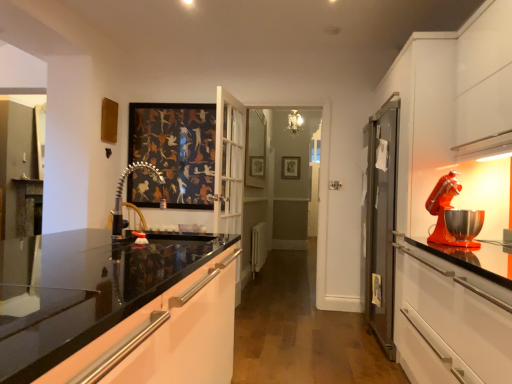
Question: From the image's perspective, would you say wooden picture frame at center is shown under polished chrome faucet at center?

Choices:
 (A) yes
 (B) no

Answer: (B)

Question: Considering the relative sizes of wooden picture frame at center and polished chrome faucet at center in the image provided, is wooden picture frame at center shorter than polished chrome faucet at center?

Choices:
 (A) yes
 (B) no

Answer: (B)

Question: Is wooden picture frame at center not inside polished chrome faucet at center?

Choices:
 (A) yes
 (B) no

Answer: (A)

Question: Is wooden picture frame at center next to polished chrome faucet at center?

Choices:
 (A) no
 (B) yes

Answer: (A)

Question: Is wooden picture frame at center turned away from polished chrome faucet at center?

Choices:
 (A) yes
 (B) no

Answer: (B)

Question: Is wooden picture frame at center further to camera compared to polished chrome faucet at center?

Choices:
 (A) no
 (B) yes

Answer: (B)

Question: Is polished chrome faucet at center oriented away from shiny orange mixer at right?

Choices:
 (A) yes
 (B) no

Answer: (B)

Question: Considering the relative sizes of polished chrome faucet at center and shiny orange mixer at right in the image provided, is polished chrome faucet at center smaller than shiny orange mixer at right?

Choices:
 (A) no
 (B) yes

Answer: (B)

Question: Is polished chrome faucet at center to the left of shiny orange mixer at right from the viewer's perspective?

Choices:
 (A) no
 (B) yes

Answer: (B)

Question: Can we say polished chrome faucet at center lies outside shiny orange mixer at right?

Choices:
 (A) yes
 (B) no

Answer: (A)

Question: From the image's perspective, is polished chrome faucet at center beneath shiny orange mixer at right?

Choices:
 (A) no
 (B) yes

Answer: (A)

Question: From a real-world perspective, is polished chrome faucet at center physically below shiny orange mixer at right?

Choices:
 (A) no
 (B) yes

Answer: (B)

Question: Is wooden picture frame at center taller than white plastic radiator at center?

Choices:
 (A) yes
 (B) no

Answer: (B)